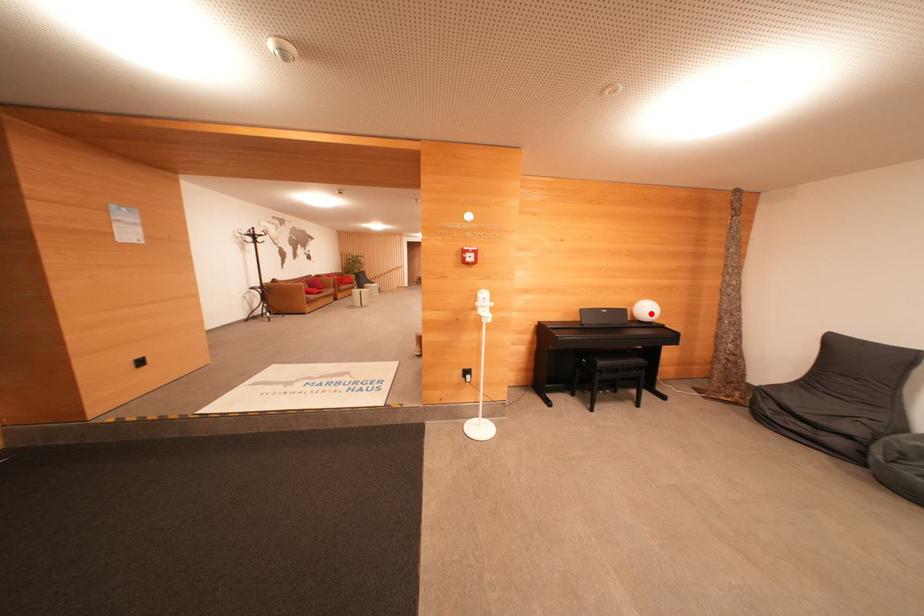
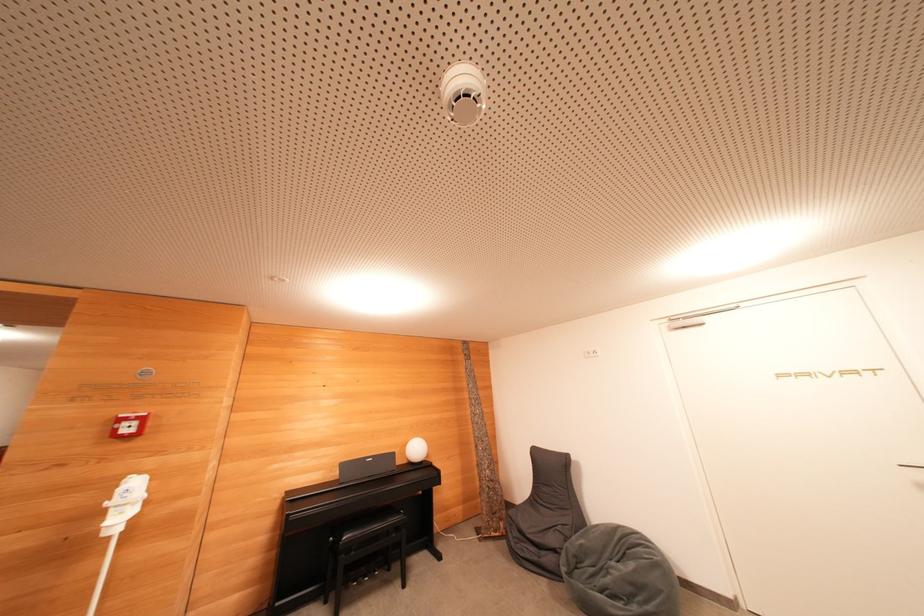
Where in the second image is the point corresponding to the highlighted location from the first image?

(419, 453)